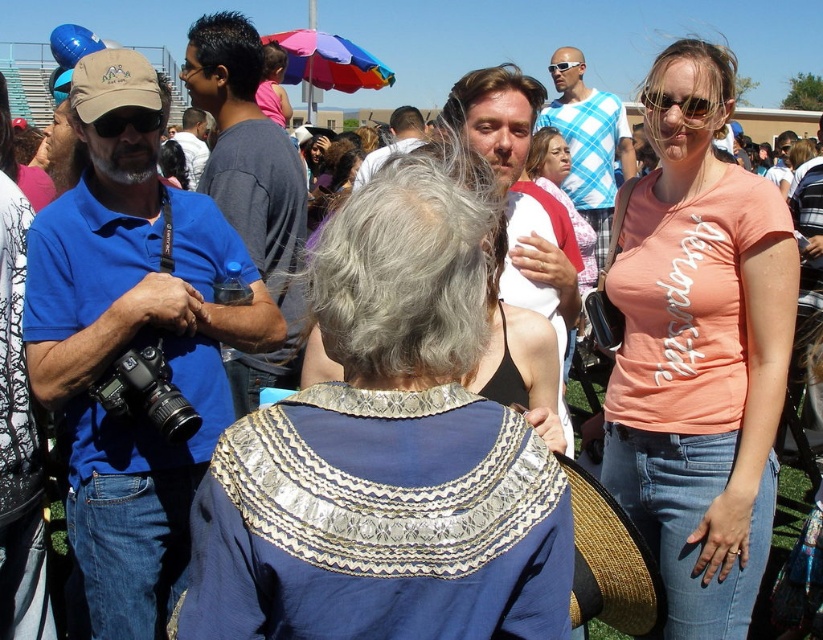
You are standing at the point labeled point (695, 109) and want to see the person behind you. Is the person at point (621, 413) visible to you?

Point (621, 413) is behind point (695, 109), so the person at point (621, 413) would be blocked by point (695, 109) and thus not visible.